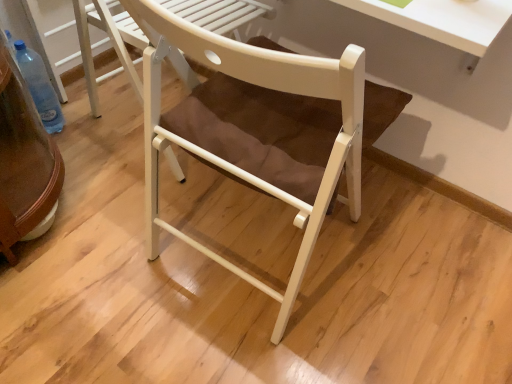
Question: From the image's perspective, would you say white matte chair at center, the 2th chair when ordered from front to back, is shown under white wood chair at center, which is counted as the second chair, starting from the back?

Choices:
 (A) no
 (B) yes

Answer: (A)

Question: Does white matte chair at center, the 2th chair when ordered from front to back, have a smaller size compared to white wood chair at center, arranged as the 1th chair when viewed from the front?

Choices:
 (A) yes
 (B) no

Answer: (A)

Question: Does white matte chair at center, the 2th chair when ordered from front to back, have a greater width compared to white wood chair at center, arranged as the 1th chair when viewed from the front?

Choices:
 (A) no
 (B) yes

Answer: (B)

Question: Is white matte chair at center, the 2th chair when ordered from front to back, aimed at white wood chair at center, arranged as the 1th chair when viewed from the front?

Choices:
 (A) no
 (B) yes

Answer: (B)

Question: From a real-world perspective, is white matte chair at center, the 2th chair when ordered from front to back, positioned over white wood chair at center, which is counted as the second chair, starting from the back, based on gravity?

Choices:
 (A) no
 (B) yes

Answer: (A)

Question: Can you confirm if white matte chair at center, the 2th chair when ordered from front to back, is shorter than white wood chair at center, arranged as the 1th chair when viewed from the front?

Choices:
 (A) yes
 (B) no

Answer: (A)

Question: Considering the relative sizes of transparent plastic bottle at lower left and white wood chair at center, arranged as the 1th chair when viewed from the front, in the image provided, is transparent plastic bottle at lower left smaller than white wood chair at center, arranged as the 1th chair when viewed from the front,?

Choices:
 (A) no
 (B) yes

Answer: (B)

Question: From a real-world perspective, is transparent plastic bottle at lower left on white wood chair at center, arranged as the 1th chair when viewed from the front?

Choices:
 (A) yes
 (B) no

Answer: (B)

Question: Does transparent plastic bottle at lower left appear on the right side of white wood chair at center, arranged as the 1th chair when viewed from the front?

Choices:
 (A) no
 (B) yes

Answer: (A)

Question: Are transparent plastic bottle at lower left and white wood chair at center, which is counted as the second chair, starting from the back, far apart?

Choices:
 (A) yes
 (B) no

Answer: (B)

Question: Is transparent plastic bottle at lower left touching white wood chair at center, arranged as the 1th chair when viewed from the front?

Choices:
 (A) yes
 (B) no

Answer: (B)

Question: From a real-world perspective, is transparent plastic bottle at lower left under white wood chair at center, which is counted as the second chair, starting from the back?

Choices:
 (A) no
 (B) yes

Answer: (B)

Question: Considering the relative sizes of transparent plastic bottle at lower left and white matte chair at center, the 2th chair when ordered from front to back, in the image provided, is transparent plastic bottle at lower left shorter than white matte chair at center, the 2th chair when ordered from front to back,?

Choices:
 (A) no
 (B) yes

Answer: (B)